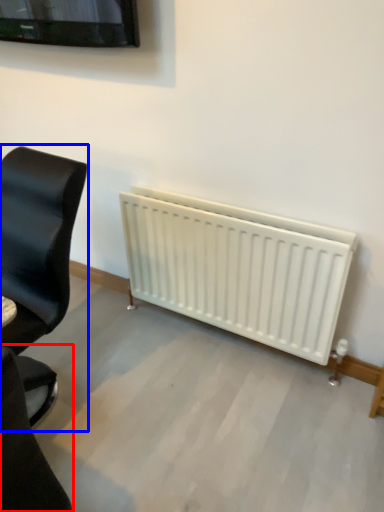
Question: Which object appears farthest to the camera in this image, chair (highlighted by a red box) or chair (highlighted by a blue box)?

Choices:
 (A) chair
 (B) chair

Answer: (B)